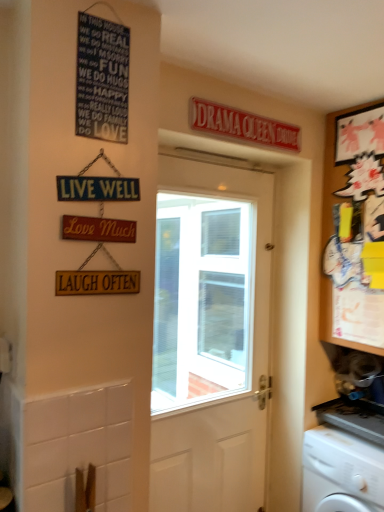
Question: From a real-world perspective, is matte black signboard at upper left over wooden cabinet at right?

Choices:
 (A) no
 (B) yes

Answer: (B)

Question: From the image's perspective, is matte black signboard at upper left under wooden cabinet at right?

Choices:
 (A) yes
 (B) no

Answer: (B)

Question: Can you confirm if matte black signboard at upper left is positioned to the right of wooden cabinet at right?

Choices:
 (A) no
 (B) yes

Answer: (A)

Question: Is matte black signboard at upper left facing away from wooden cabinet at right?

Choices:
 (A) no
 (B) yes

Answer: (A)

Question: Considering the relative positions of matte black signboard at upper left and wooden cabinet at right in the image provided, is matte black signboard at upper left behind wooden cabinet at right?

Choices:
 (A) yes
 (B) no

Answer: (B)

Question: From the image's perspective, is wooden cabinet at right positioned above or below white plastic washing machine at lower right?

Choices:
 (A) below
 (B) above

Answer: (B)

Question: Would you say wooden cabinet at right is inside or outside white plastic washing machine at lower right?

Choices:
 (A) inside
 (B) outside

Answer: (B)

Question: Relative to white plastic washing machine at lower right, is wooden cabinet at right in front or behind?

Choices:
 (A) front
 (B) behind

Answer: (B)

Question: From a real-world perspective, relative to white plastic washing machine at lower right, is wooden cabinet at right vertically above or below?

Choices:
 (A) below
 (B) above

Answer: (B)

Question: Based on their sizes in the image, would you say red plastic sign at upper center is bigger or smaller than white wooden door at center?

Choices:
 (A) small
 (B) big

Answer: (A)

Question: Which is correct: red plastic sign at upper center is inside white wooden door at center, or outside of it?

Choices:
 (A) inside
 (B) outside

Answer: (B)

Question: In terms of width, does red plastic sign at upper center look wider or thinner when compared to white wooden door at center?

Choices:
 (A) thin
 (B) wide

Answer: (A)

Question: From a real-world perspective, is red plastic sign at upper center above or below white wooden door at center?

Choices:
 (A) above
 (B) below

Answer: (A)

Question: Looking at their shapes, would you say white wooden door at center is wider or thinner than white plastic washing machine at lower right?

Choices:
 (A) wide
 (B) thin

Answer: (B)

Question: Is white wooden door at center inside or outside of white plastic washing machine at lower right?

Choices:
 (A) inside
 (B) outside

Answer: (B)